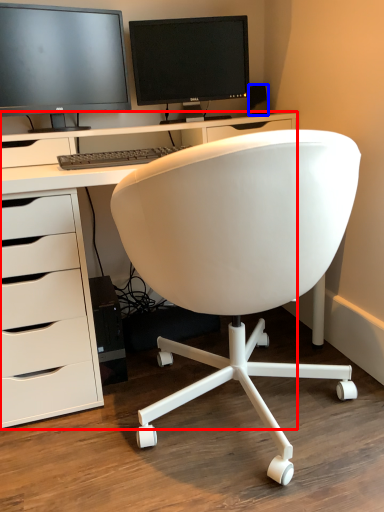
Question: Which of the following is the closest to the observer, desk (highlighted by a red box) or office supplies (highlighted by a blue box)?

Choices:
 (A) desk
 (B) office supplies

Answer: (A)